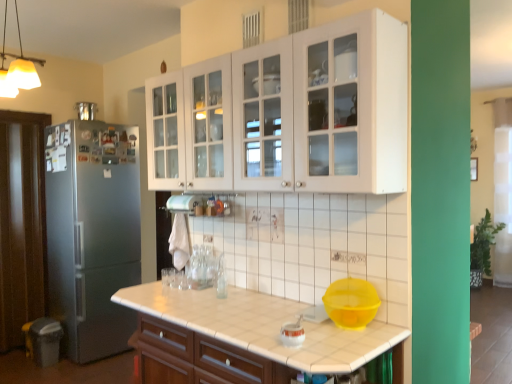
How much space does brushed metal refrigerator at left, which is the first appliance from left to right, occupy horizontally?

brushed metal refrigerator at left, which is the first appliance from left to right, is 12.55 centimeters wide.

Locate an element on the screen. brushed metal refrigerator at left, arranged as the second appliance when viewed from the right is located at coordinates (86, 110).

Image resolution: width=512 pixels, height=384 pixels. Identify the location of white glossy kettle at center, placed as the second appliance when sorted from left to right. (292, 333).

Find the location of a particular element. The width and height of the screenshot is (512, 384). yellow plastic mixing bowl at lower center is located at coordinates (351, 303).

Does white glossy cabinet at upper center, arranged as the 2th cabinetry when ordered from the bottom, appear on the right side of white glossy kettle at center, which appears as the first appliance when viewed from the front?

No, white glossy cabinet at upper center, arranged as the 2th cabinetry when ordered from the bottom, is not to the right of white glossy kettle at center, which appears as the first appliance when viewed from the front.

Could you tell me if white glossy cabinet at upper center, arranged as the 2th cabinetry when ordered from the bottom, is facing white glossy kettle at center, placed as the second appliance when sorted from left to right?

No, white glossy cabinet at upper center, arranged as the 2th cabinetry when ordered from the bottom, is not facing towards white glossy kettle at center, placed as the second appliance when sorted from left to right.

Which is behind, point (316, 89) or point (302, 328)?

The point (316, 89) is farther.

Does white glossy cabinet at upper center, which is the 1th cabinetry in top-to-bottom order, have a lesser width compared to white glossy kettle at center, positioned as the 1th appliance in bottom-to-top order?

In fact, white glossy cabinet at upper center, which is the 1th cabinetry in top-to-bottom order, might be wider than white glossy kettle at center, positioned as the 1th appliance in bottom-to-top order.

Does satin silver refrigerator at left come behind yellow plastic mixing bowl at lower center?

Yes.

At what (x,y) coordinates should I click in order to perform the action: click on mixing bowl below the satin silver refrigerator at left (from the image's perspective). Please return your answer as a coordinate pair (x, y). The image size is (512, 384). Looking at the image, I should click on (351, 303).

Consider the image. From the image's perspective, which object appears higher, satin silver refrigerator at left or yellow plastic mixing bowl at lower center?

satin silver refrigerator at left is shown above in the image.

Consider the image. Are yellow plastic mixing bowl at lower center and brushed metal refrigerator at left, which is the first appliance from left to right, beside each other?

yellow plastic mixing bowl at lower center is not next to brushed metal refrigerator at left, which is the first appliance from left to right, and they're not touching.

Based on their positions, is yellow plastic mixing bowl at lower center located to the left or right of brushed metal refrigerator at left, arranged as the second appliance when viewed from the right?

Based on their positions, yellow plastic mixing bowl at lower center is located to the right of brushed metal refrigerator at left, arranged as the second appliance when viewed from the right.

From a real-world perspective, which is physically below, yellow plastic mixing bowl at lower center or brushed metal refrigerator at left, acting as the second appliance starting from the bottom?

yellow plastic mixing bowl at lower center is physically lower.

Considering the positions of point (86, 102) and point (122, 190), is point (86, 102) closer or farther from the camera than point (122, 190)?

Clearly, point (86, 102) is more distant from the camera than point (122, 190).

How far apart are brushed metal refrigerator at left, arranged as the second appliance when viewed from the right, and satin silver refrigerator at left?

brushed metal refrigerator at left, arranged as the second appliance when viewed from the right, and satin silver refrigerator at left are 3.31 feet apart from each other.

You are a GUI agent. You are given a task and a screenshot of the screen. Output one action in this format:
    pyautogui.click(x=<x>, y=<y>)
    Task: Click on the appliance above the satin silver refrigerator at left (from the image's perspective)
    The height and width of the screenshot is (384, 512).
    Given the screenshot: What is the action you would take?
    pyautogui.click(x=86, y=110)

Which of these two, brushed metal refrigerator at left, which is the first appliance from left to right, or satin silver refrigerator at left, is bigger?

satin silver refrigerator at left.

Does point (76, 102) come closer to viewer compared to point (328, 299)?

No, (76, 102) is behind (328, 299).

Is brushed metal refrigerator at left, placed as the first appliance when sorted from top to bottom, taller or shorter than yellow plastic mixing bowl at lower center?

In the image, brushed metal refrigerator at left, placed as the first appliance when sorted from top to bottom, appears to be shorter than yellow plastic mixing bowl at lower center.

Which object is more forward, brushed metal refrigerator at left, marked as the 1th appliance in a back-to-front arrangement, or yellow plastic mixing bowl at lower center?

yellow plastic mixing bowl at lower center.

Could you measure the distance between brushed metal refrigerator at left, placed as the first appliance when sorted from top to bottom, and yellow plastic mixing bowl at lower center?

brushed metal refrigerator at left, placed as the first appliance when sorted from top to bottom, is 9.50 feet away from yellow plastic mixing bowl at lower center.

Which of these two, white glossy cabinet at upper center, which is the 1th cabinetry in top-to-bottom order, or satin silver refrigerator at left, is wider?

satin silver refrigerator at left is wider.

From a real-world perspective, is white glossy cabinet at upper center, which is the 1th cabinetry in top-to-bottom order, positioned above or below satin silver refrigerator at left?

Clearly, from a real-world perspective, white glossy cabinet at upper center, which is the 1th cabinetry in top-to-bottom order, is above satin silver refrigerator at left.

How many degrees apart are the facing directions of white glossy cabinet at upper center, arranged as the 2th cabinetry when ordered from the bottom, and satin silver refrigerator at left?

white glossy cabinet at upper center, arranged as the 2th cabinetry when ordered from the bottom, and satin silver refrigerator at left are facing 88.7 degrees away from each other.

Considering the relative positions of white glossy cabinet at upper center, which is the 1th cabinetry in top-to-bottom order, and satin silver refrigerator at left in the image provided, is white glossy cabinet at upper center, which is the 1th cabinetry in top-to-bottom order, to the left of satin silver refrigerator at left from the viewer's perspective?

In fact, white glossy cabinet at upper center, which is the 1th cabinetry in top-to-bottom order, is to the right of satin silver refrigerator at left.

How distant is yellow plastic mixing bowl at lower center from white glossy kettle at center, which appears as the first appliance when viewed from the front?

The distance of yellow plastic mixing bowl at lower center from white glossy kettle at center, which appears as the first appliance when viewed from the front, is 9.66 inches.

Which object is closer to the camera taking this photo, yellow plastic mixing bowl at lower center or white glossy kettle at center, placed as the second appliance when sorted from left to right?

white glossy kettle at center, placed as the second appliance when sorted from left to right, is in front.

Looking at this image, can you confirm if yellow plastic mixing bowl at lower center is wider than white glossy kettle at center, marked as the first appliance in a right-to-left arrangement?

Yes, yellow plastic mixing bowl at lower center is wider than white glossy kettle at center, marked as the first appliance in a right-to-left arrangement.

From the image's perspective, is yellow plastic mixing bowl at lower center located above or below white glossy kettle at center, positioned as the 2th appliance in top-to-bottom order?

Based on their image positions, yellow plastic mixing bowl at lower center is located above white glossy kettle at center, positioned as the 2th appliance in top-to-bottom order.

The width and height of the screenshot is (512, 384). What are the coordinates of `appliance located underneath the white glossy cabinet at upper center, which is the 1th cabinetry in top-to-bottom order (from a real-world perspective)` in the screenshot? It's located at (292, 333).

Find the location of `mixing bowl that appears in front of the satin silver refrigerator at left`. mixing bowl that appears in front of the satin silver refrigerator at left is located at coordinates (351, 303).

Looking at the image, which one is located further to brushed metal refrigerator at left, placed as the first appliance when sorted from top to bottom, satin silver refrigerator at left or white glossy kettle at center, positioned as the 2th appliance in top-to-bottom order?

white glossy kettle at center, positioned as the 2th appliance in top-to-bottom order, is further to brushed metal refrigerator at left, placed as the first appliance when sorted from top to bottom.

Considering their positions, is white glossy cabinet at upper center, arranged as the 2th cabinetry when ordered from the bottom, positioned further to white glossy kettle at center, positioned as the 1th appliance in bottom-to-top order, than matte white countertop at center, the 2th cabinetry from the top?

The object further to white glossy kettle at center, positioned as the 1th appliance in bottom-to-top order, is white glossy cabinet at upper center, arranged as the 2th cabinetry when ordered from the bottom.

Which object lies further to the anchor point white glossy cabinet at upper center, which is the 1th cabinetry in top-to-bottom order, satin silver refrigerator at left or brushed metal refrigerator at left, arranged as the second appliance when viewed from the right?

Based on the image, brushed metal refrigerator at left, arranged as the second appliance when viewed from the right, appears to be further to white glossy cabinet at upper center, which is the 1th cabinetry in top-to-bottom order.

From the image, which object appears to be farther from white glossy kettle at center, arranged as the second appliance when viewed from the back, satin silver refrigerator at left or yellow plastic mixing bowl at lower center?

Based on the image, satin silver refrigerator at left appears to be further to white glossy kettle at center, arranged as the second appliance when viewed from the back.

From the picture: Based on their spatial positions, is white glossy cabinet at upper center, arranged as the 2th cabinetry when ordered from the bottom, or brushed metal refrigerator at left, which is the second appliance in front-to-back order, closer to matte white countertop at center, the 2th cabinetry from the top?

white glossy cabinet at upper center, arranged as the 2th cabinetry when ordered from the bottom, is positioned closer to the anchor matte white countertop at center, the 2th cabinetry from the top.

Looking at the image, which one is located further to yellow plastic mixing bowl at lower center, brushed metal refrigerator at left, acting as the second appliance starting from the bottom, or white glossy kettle at center, positioned as the 1th appliance in bottom-to-top order?

brushed metal refrigerator at left, acting as the second appliance starting from the bottom, lies further to yellow plastic mixing bowl at lower center than the other object.

From the image, which object appears to be nearer to yellow plastic mixing bowl at lower center, white glossy kettle at center, which appears as the first appliance when viewed from the front, or white glossy cabinet at upper center, which is the 1th cabinetry in top-to-bottom order?

white glossy kettle at center, which appears as the first appliance when viewed from the front, lies closer to yellow plastic mixing bowl at lower center than the other object.

Estimate the real-world distances between objects in this image. Which object is closer to white glossy kettle at center, positioned as the 1th appliance in bottom-to-top order, brushed metal refrigerator at left, which is the first appliance from left to right, or yellow plastic mixing bowl at lower center?

yellow plastic mixing bowl at lower center is closer to white glossy kettle at center, positioned as the 1th appliance in bottom-to-top order.

The width and height of the screenshot is (512, 384). Find the location of `mixing bowl between white glossy cabinet at upper center, arranged as the 2th cabinetry when ordered from the bottom, and matte white countertop at center, marked as the 1th cabinetry in a bottom-to-top arrangement, vertically`. mixing bowl between white glossy cabinet at upper center, arranged as the 2th cabinetry when ordered from the bottom, and matte white countertop at center, marked as the 1th cabinetry in a bottom-to-top arrangement, vertically is located at coordinates (351, 303).

I want to click on mixing bowl located between matte white countertop at center, the 2th cabinetry from the top, and brushed metal refrigerator at left, which is the second appliance in front-to-back order, in the depth direction, so click(351, 303).

This screenshot has width=512, height=384. I want to click on cabinetry between matte white countertop at center, the 2th cabinetry from the top, and satin silver refrigerator at left from front to back, so click(x=289, y=114).

Find the location of a particular element. This screenshot has height=384, width=512. appliance between matte white countertop at center, marked as the 1th cabinetry in a bottom-to-top arrangement, and satin silver refrigerator at left in the front-back direction is located at coordinates (292, 333).